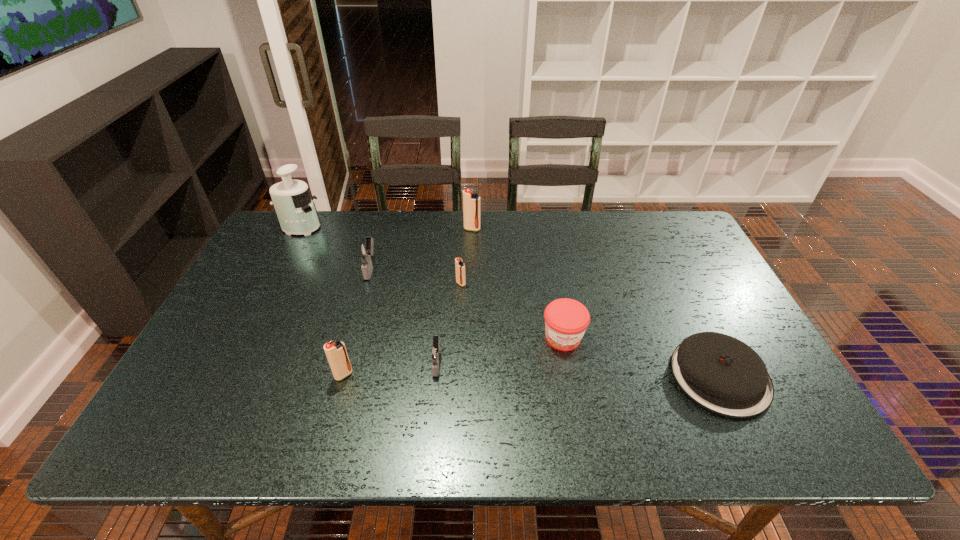
What are the coordinates of `free space located 0.400m on the front of the second farthest red igniter` in the screenshot? It's located at (455, 410).

The width and height of the screenshot is (960, 540). What are the coordinates of `vacant space located on the right of the smaller gray igniter` in the screenshot? It's located at (594, 363).

In order to click on vacant area located 0.050m on the front of the shortest object in this screenshot , I will do `click(751, 441)`.

I want to click on juicer present at the far edge, so click(294, 207).

At what (x,y) coordinates should I click in order to perform the action: click on igniter situated at the far edge. Please return your answer as a coordinate pair (x, y). This screenshot has width=960, height=540. Looking at the image, I should click on (471, 202).

Find the location of a particular element. The height and width of the screenshot is (540, 960). object positioned at the near edge is located at coordinates (722, 374).

Where is `object positioned at the left edge`? This screenshot has width=960, height=540. object positioned at the left edge is located at coordinates (294, 207).

At what (x,y) coordinates should I click in order to perform the action: click on object situated at the right edge. Please return your answer as a coordinate pair (x, y). This screenshot has width=960, height=540. Looking at the image, I should click on (722, 374).

At what (x,y) coordinates should I click in order to perform the action: click on object that is at the far left corner. Please return your answer as a coordinate pair (x, y). The height and width of the screenshot is (540, 960). Looking at the image, I should click on (294, 207).

The height and width of the screenshot is (540, 960). I want to click on object positioned at the near right corner, so click(722, 374).